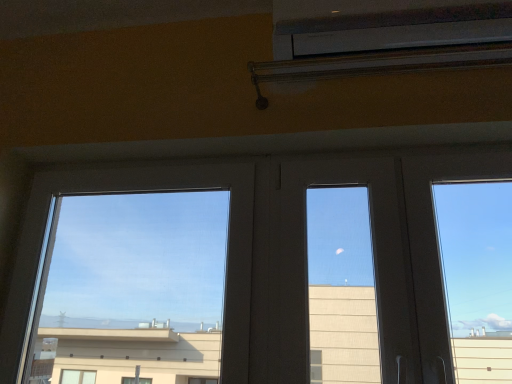
Where is `white plastic air conditioning unit at upper center`? The height and width of the screenshot is (384, 512). white plastic air conditioning unit at upper center is located at coordinates (385, 25).

Describe the element at coordinates (385, 25) in the screenshot. I see `white plastic air conditioning unit at upper center` at that location.

This screenshot has height=384, width=512. Find the location of `transparent glass window at left`. transparent glass window at left is located at coordinates (135, 191).

The image size is (512, 384). What do you see at coordinates (135, 191) in the screenshot?
I see `transparent glass window at left` at bounding box center [135, 191].

Find the location of a particular element. white plastic air conditioning unit at upper center is located at coordinates (385, 25).

Does transparent glass window at left appear on the left side of white plastic air conditioning unit at upper center?

Indeed, transparent glass window at left is positioned on the left side of white plastic air conditioning unit at upper center.

Between transparent glass window at left and white plastic air conditioning unit at upper center, which one is positioned behind?

transparent glass window at left is further away from the camera.

Is point (48, 198) behind point (306, 22)?

Yes, it is behind point (306, 22).

From the image's perspective, between transparent glass window at left and white plastic air conditioning unit at upper center, who is located below?

transparent glass window at left is shown below in the image.

From a real-world perspective, does transparent glass window at left stand above white plastic air conditioning unit at upper center?

No, from a real-world perspective, transparent glass window at left is not on top of white plastic air conditioning unit at upper center.

Which of these two, transparent glass window at left or white plastic air conditioning unit at upper center, is thinner?

Thinner between the two is transparent glass window at left.

Can you confirm if transparent glass window at left is taller than white plastic air conditioning unit at upper center?

Indeed, transparent glass window at left has a greater height compared to white plastic air conditioning unit at upper center.

Between transparent glass window at left and white plastic air conditioning unit at upper center, which one has larger size?

transparent glass window at left.

Could white plastic air conditioning unit at upper center be considered to be inside transparent glass window at left?

No, white plastic air conditioning unit at upper center is located outside of transparent glass window at left.

Is transparent glass window at left in contact with white plastic air conditioning unit at upper center?

No, transparent glass window at left is not next to white plastic air conditioning unit at upper center.

Does transparent glass window at left turn towards white plastic air conditioning unit at upper center?

No.

I want to click on window lying behind the white plastic air conditioning unit at upper center, so click(135, 191).

In the image, is white plastic air conditioning unit at upper center on the left side or the right side of transparent glass window at left?

white plastic air conditioning unit at upper center is to the right of transparent glass window at left.

Which object is further away from the camera taking this photo, white plastic air conditioning unit at upper center or transparent glass window at left?

Positioned behind is transparent glass window at left.

Which is less distant, [392,35] or [247,192]?

The point [392,35] is closer.

Looking at this image, from the image's perspective, which is below, white plastic air conditioning unit at upper center or transparent glass window at left?

transparent glass window at left.

From a real-world perspective, which is physically below, white plastic air conditioning unit at upper center or transparent glass window at left?

transparent glass window at left is physically lower.

Is white plastic air conditioning unit at upper center thinner than transparent glass window at left?

In fact, white plastic air conditioning unit at upper center might be wider than transparent glass window at left.

Looking at this image, can you confirm if white plastic air conditioning unit at upper center is taller than transparent glass window at left?

Incorrect, the height of white plastic air conditioning unit at upper center is not larger of that of transparent glass window at left.

Is white plastic air conditioning unit at upper center bigger or smaller than transparent glass window at left?

Considering their sizes, white plastic air conditioning unit at upper center takes up less space than transparent glass window at left.

Does white plastic air conditioning unit at upper center contain transparent glass window at left?

Definitely not — transparent glass window at left is not inside white plastic air conditioning unit at upper center.

Is white plastic air conditioning unit at upper center touching transparent glass window at left?

There is a gap between white plastic air conditioning unit at upper center and transparent glass window at left.

Is white plastic air conditioning unit at upper center oriented away from transparent glass window at left?

No, transparent glass window at left is not at the back of white plastic air conditioning unit at upper center.

From the picture: How distant is white plastic air conditioning unit at upper center from transparent glass window at left?

white plastic air conditioning unit at upper center is 25.06 inches from transparent glass window at left.

Image resolution: width=512 pixels, height=384 pixels. What are the coordinates of `window that appears behind the white plastic air conditioning unit at upper center` in the screenshot? It's located at (135, 191).

Locate an element on the screen. window on the left side of white plastic air conditioning unit at upper center is located at coordinates (135, 191).

Locate an element on the screen. air conditioning located on the right of transparent glass window at left is located at coordinates (385, 25).